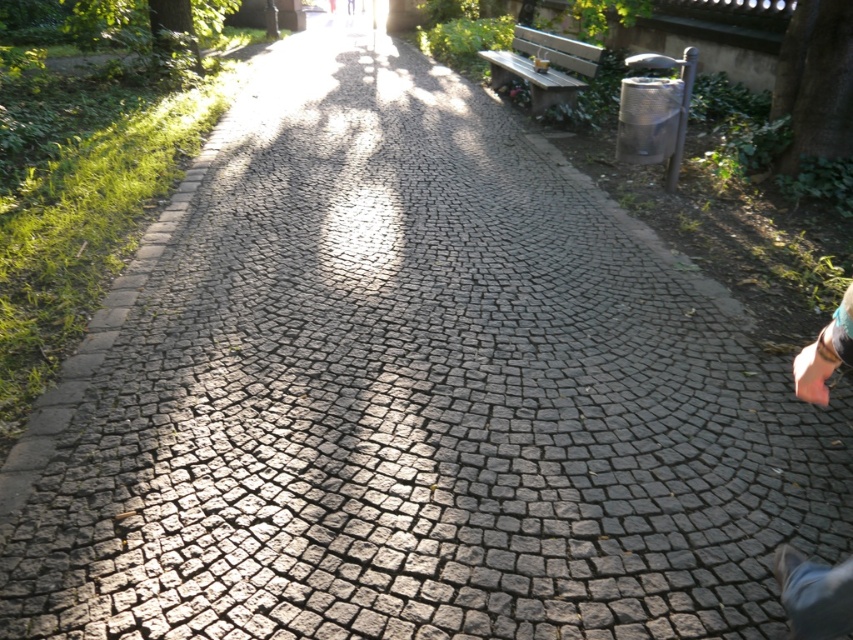
You are standing at the entrance of the park and see the light pink fabric at lower right. If you want to reach it, how many steps would you need to take if each step covers 1.5 feet?

The light pink fabric at lower right is 5.53 feet away from viewer. Since each step covers 1.5 feet, you would need approximately 4 steps to reach it.

You are standing at the camera position and want to walk to both points. Which point should you reach first, point (833, 356) or point (526, 65)?

You should reach point (833, 356) first because it is closer to the camera than point (526, 65).